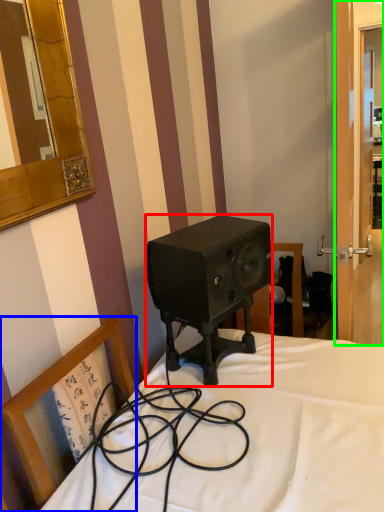
Question: Estimate the real-world distances between objects in this image. Which object is closer to speaker (highlighted by a red box), chair (highlighted by a blue box) or screen door (highlighted by a green box)?

Choices:
 (A) chair
 (B) screen door

Answer: (A)